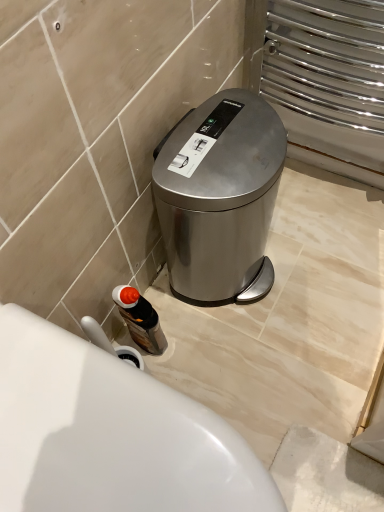
Question: Considering the positions of point (150, 348) and point (213, 433), is point (150, 348) closer or farther from the camera than point (213, 433)?

Choices:
 (A) closer
 (B) farther

Answer: (B)

Question: Is translucent plastic bottle at lower left wider or thinner than white glossy toilet at lower left?

Choices:
 (A) wide
 (B) thin

Answer: (B)

Question: Estimate the real-world distances between objects in this image. Which object is closer to the satin metallic trash can at lower right?

Choices:
 (A) translucent plastic bottle at lower left
 (B) white glossy toilet at lower left

Answer: (A)

Question: Which of these objects is positioned closest to the white glossy toilet at lower left?

Choices:
 (A) satin metallic trash can at lower right
 (B) translucent plastic bottle at lower left

Answer: (B)